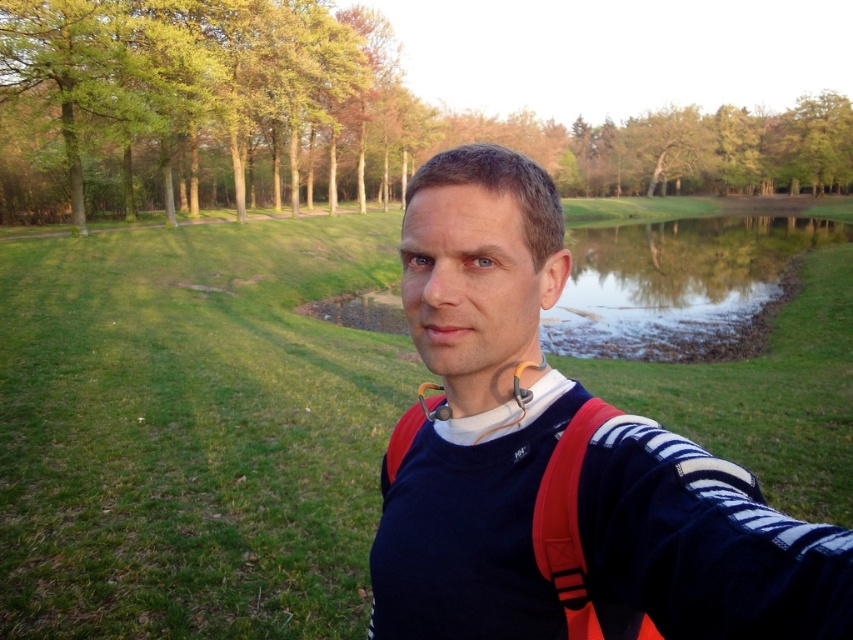
Can you confirm if navy blue sweater at center is thinner than clear water at pond right?

Correct, navy blue sweater at center's width is less than clear water at pond right's.

Is point (717, 512) behind point (695, 269)?

No, (717, 512) is in front of (695, 269).

In order to click on navy blue sweater at center in this screenshot , I will do `click(560, 458)`.

Looking at this image, does green leafy tree at upper center have a greater width compared to clear water at pond right?

Indeed, green leafy tree at upper center has a greater width compared to clear water at pond right.

Can you confirm if green leafy tree at upper center is smaller than clear water at pond right?

Actually, green leafy tree at upper center might be larger than clear water at pond right.

Between point (286, 195) and point (778, 282), which one is positioned in front?

Positioned in front is point (778, 282).

You are a GUI agent. You are given a task and a screenshot of the screen. Output one action in this format:
    pyautogui.click(x=<x>, y=<y>)
    Task: Click on the green leafy tree at upper center
    
    Given the screenshot: What is the action you would take?
    pyautogui.click(x=321, y=116)

Based on the photo, who is taller, navy blue sweater at center or green leafy tree at upper center?

Standing taller between the two is green leafy tree at upper center.

Which of these two, navy blue sweater at center or green leafy tree at upper center, stands shorter?

With less height is navy blue sweater at center.

Image resolution: width=853 pixels, height=640 pixels. What do you see at coordinates (560, 458) in the screenshot?
I see `navy blue sweater at center` at bounding box center [560, 458].

Locate an element on the screen. navy blue sweater at center is located at coordinates (560, 458).